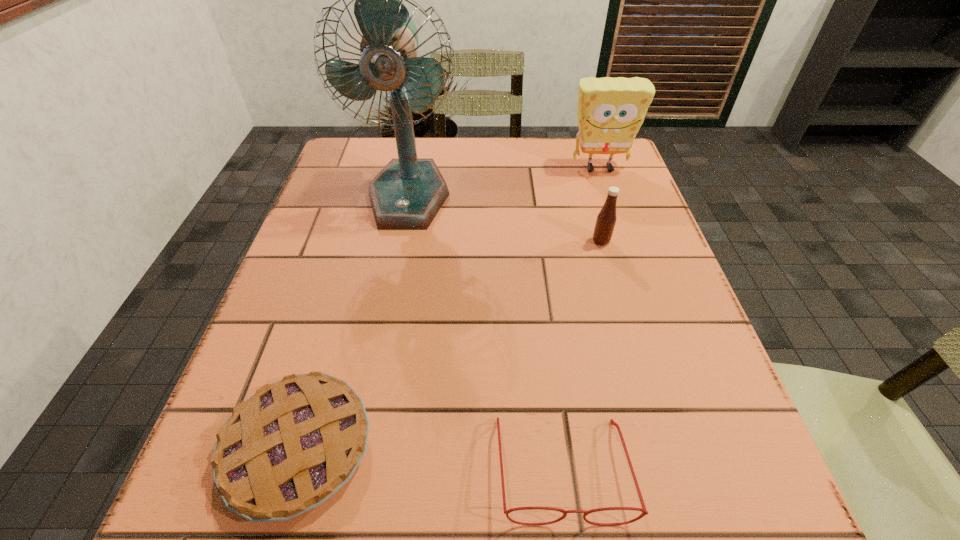
Locate an element on the screen. The height and width of the screenshot is (540, 960). free space between the fan and the shortest object is located at coordinates (353, 322).

Locate an element on the screen. unoccupied area between the second shortest object and the shortest object is located at coordinates (430, 458).

Image resolution: width=960 pixels, height=540 pixels. I want to click on free space between the fourth shortest object and the Tabasco sauce, so click(600, 205).

Identify the location of free area in between the tallest object and the third tallest object. The image size is (960, 540). (505, 218).

Identify the location of free spot between the third tallest object and the second shortest object. (582, 355).

Locate an element on the screen. This screenshot has width=960, height=540. empty location between the tallest object and the second tallest object is located at coordinates (504, 183).

Find the location of `free area in between the tallest object and the pie`. free area in between the tallest object and the pie is located at coordinates (353, 322).

Point out which object is positioned as the fourth nearest to the pie. Please provide its 2D coordinates. Your answer should be formatted as a tuple, i.e. [(x, y)], where the tuple contains the x and y coordinates of a point satisfying the conditions above.

[(610, 112)]

Locate which object ranks in proximity to the Tabasco sauce. Please provide its 2D coordinates. Your answer should be formatted as a tuple, i.e. [(x, y)], where the tuple contains the x and y coordinates of a point satisfying the conditions above.

[(610, 112)]